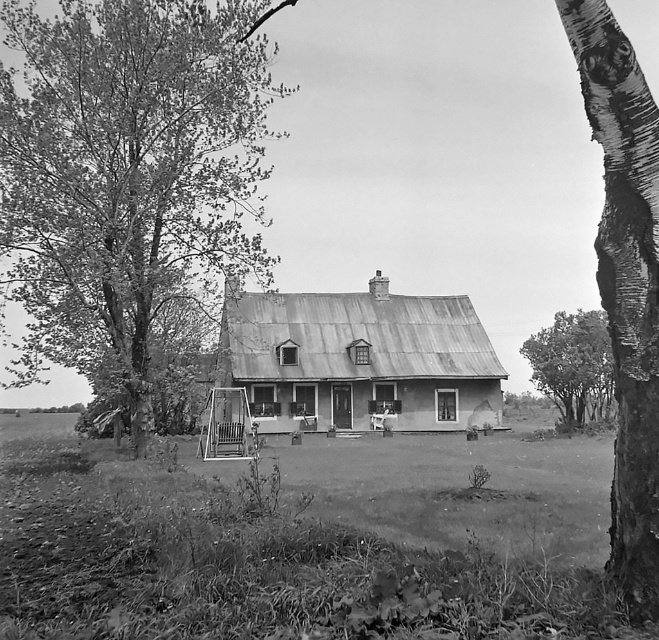
Question: Is smooth bark tree at left behind smooth bark tree at right?

Choices:
 (A) yes
 (B) no

Answer: (B)

Question: Does smooth bark birch tree at right come in front of smooth bark tree at right?

Choices:
 (A) no
 (B) yes

Answer: (B)

Question: Is smooth bark tree at left wider than smooth bark tree at right?

Choices:
 (A) yes
 (B) no

Answer: (A)

Question: Which point appears closest to the camera in this image?

Choices:
 (A) (571, 387)
 (B) (635, 195)
 (C) (30, 131)

Answer: (B)

Question: Which point is farther to the camera?

Choices:
 (A) (34, 61)
 (B) (558, 381)

Answer: (B)

Question: Which object appears closest to the camera in this image?

Choices:
 (A) smooth bark tree at right
 (B) smooth bark birch tree at right

Answer: (B)